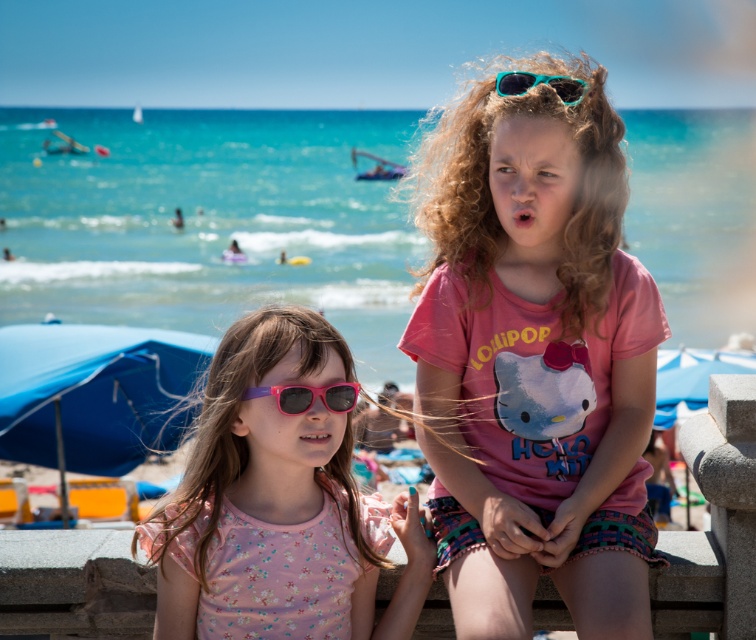
Is pink matte sunglasses at center above pink plastic goggles at center?

No, pink matte sunglasses at center is not above pink plastic goggles at center.

In the scene shown: Does pink matte sunglasses at center have a greater height compared to pink plastic goggles at center?

Indeed, pink matte sunglasses at center has a greater height compared to pink plastic goggles at center.

Is point (361, 611) positioned in front of point (335, 396)?

No, it is behind (335, 396).

What are the coordinates of `pink matte sunglasses at center` in the screenshot? It's located at (277, 502).

Which is more to the left, pink matte sunglasses at center or teal plastic goggles at upper center?

pink matte sunglasses at center is more to the left.

Is pink matte sunglasses at center positioned at the back of teal plastic goggles at upper center?

No, it is in front of teal plastic goggles at upper center.

Which is in front, point (236, 577) or point (504, 77)?

Positioned in front is point (236, 577).

Locate an element on the screen. The image size is (756, 640). pink matte sunglasses at center is located at coordinates (277, 502).

Who is shorter, pink matte shirt at center or pink plastic goggles at center?

pink plastic goggles at center is shorter.

Does pink matte shirt at center have a greater width compared to pink plastic goggles at center?

Indeed, pink matte shirt at center has a greater width compared to pink plastic goggles at center.

Which is in front, point (420, 314) or point (245, 390)?

Point (245, 390) is more forward.

At what (x,y) coordinates should I click in order to perform the action: click on pink matte shirt at center. Please return your answer as a coordinate pair (x, y). The image size is (756, 640). Looking at the image, I should click on (534, 358).